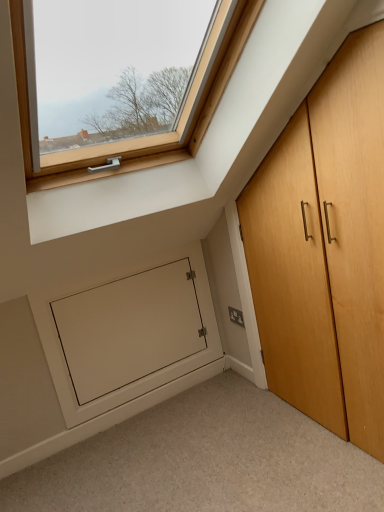
Question: From the image's perspective, is white matte door at lower left positioned above or below white matte door at lower left?

Choices:
 (A) above
 (B) below

Answer: (A)

Question: From a real-world perspective, is white matte door at lower left above or below white matte door at lower left?

Choices:
 (A) above
 (B) below

Answer: (A)

Question: Which object is positioned closest to the white matte door at lower left?

Choices:
 (A) satin silver plate at lower right
 (B) light brown wood cupboard at right
 (C) white matte door at lower left

Answer: (C)

Question: Estimate the real-world distances between objects in this image. Which object is closer to the satin silver plate at lower right?

Choices:
 (A) white matte door at lower left
 (B) light brown wood cupboard at right
 (C) white matte door at lower left

Answer: (C)